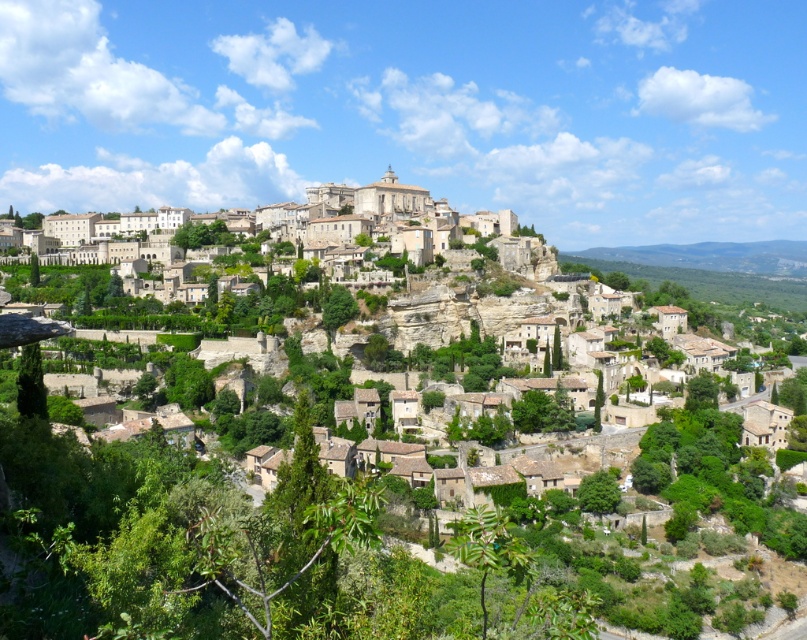
You are standing in the lower left corner of the hillside village and want to reach the brown stone buildings at center. Which direction should you move relative to the beige stone buildings at upper center?

The beige stone buildings at upper center are to the left of the brown stone buildings at center. Therefore, to reach the brown stone buildings at center from the lower left corner, you should move to the right of the beige stone buildings at upper center.